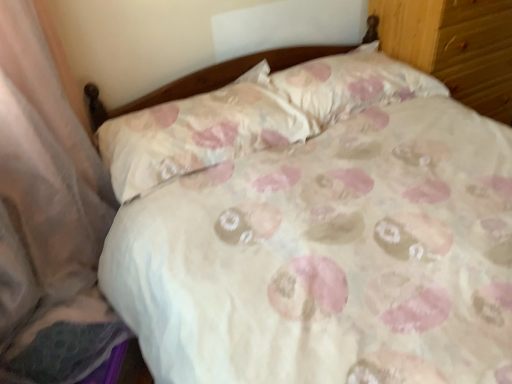
Locate an element on the screen. white fabric pillow at center, which is counted as the 1th pillow, starting from the left is located at coordinates (198, 132).

The height and width of the screenshot is (384, 512). I want to click on dresser that appears above the white fabric pillow at center, the 2th pillow in the right-to-left sequence (from the image's perspective), so click(x=455, y=46).

From a real-world perspective, is wooden dresser at upper right located beneath white fabric pillow at center, the 2th pillow in the right-to-left sequence?

Yes, from a real-world perspective, wooden dresser at upper right is under white fabric pillow at center, the 2th pillow in the right-to-left sequence.

Considering the relative positions of wooden dresser at upper right and white fabric pillow at center, which is counted as the 1th pillow, starting from the left, in the image provided, is wooden dresser at upper right to the left of white fabric pillow at center, which is counted as the 1th pillow, starting from the left, from the viewer's perspective?

In fact, wooden dresser at upper right is to the right of white fabric pillow at center, which is counted as the 1th pillow, starting from the left.

Which of these two, floral fabric pillow at upper center, the 2th pillow in the left-to-right sequence, or white fabric pillow at center, which is counted as the 1th pillow, starting from the left, stands shorter?

white fabric pillow at center, which is counted as the 1th pillow, starting from the left, is shorter.

From the picture: Is floral fabric pillow at upper center, placed as the first pillow when sorted from right to left, completely or partially outside of white fabric pillow at center, the 2th pillow in the right-to-left sequence?

Yes.

Which point is more forward, (330, 103) or (205, 116)?

The point (205, 116) is in front.

From the image's perspective, does floral fabric pillow at upper center, the 2th pillow in the left-to-right sequence, appear higher than white fabric pillow at center, which is counted as the 1th pillow, starting from the left?

Yes, from the image's perspective, floral fabric pillow at upper center, the 2th pillow in the left-to-right sequence, is above white fabric pillow at center, which is counted as the 1th pillow, starting from the left.

Is white fabric pillow at center, which is counted as the 1th pillow, starting from the left, positioned far away from floral fabric pillow at upper center, the 2th pillow in the left-to-right sequence?

No, white fabric pillow at center, which is counted as the 1th pillow, starting from the left, is in close proximity to floral fabric pillow at upper center, the 2th pillow in the left-to-right sequence.

This screenshot has width=512, height=384. I want to click on pillow in front of the floral fabric pillow at upper center, placed as the first pillow when sorted from right to left, so click(198, 132).

Does white fabric pillow at center, which is counted as the 1th pillow, starting from the left, turn towards floral fabric pillow at upper center, the 2th pillow in the left-to-right sequence?

No, white fabric pillow at center, which is counted as the 1th pillow, starting from the left, does not turn towards floral fabric pillow at upper center, the 2th pillow in the left-to-right sequence.

From their relative heights in the image, would you say white fabric pillow at center, the 2th pillow in the right-to-left sequence, is taller or shorter than floral fabric pillow at upper center, placed as the first pillow when sorted from right to left?

Clearly, white fabric pillow at center, the 2th pillow in the right-to-left sequence, is shorter compared to floral fabric pillow at upper center, placed as the first pillow when sorted from right to left.

In the image, is floral fabric pillow at upper center, the 2th pillow in the left-to-right sequence, positioned in front of or behind wooden dresser at upper right?

Visually, floral fabric pillow at upper center, the 2th pillow in the left-to-right sequence, is located in front of wooden dresser at upper right.

Looking at this image, considering the relative sizes of floral fabric pillow at upper center, the 2th pillow in the left-to-right sequence, and wooden dresser at upper right in the image provided, is floral fabric pillow at upper center, the 2th pillow in the left-to-right sequence, taller than wooden dresser at upper right?

In fact, floral fabric pillow at upper center, the 2th pillow in the left-to-right sequence, may be shorter than wooden dresser at upper right.

How different are the orientations of floral fabric pillow at upper center, the 2th pillow in the left-to-right sequence, and wooden dresser at upper right in degrees?

The angle between the facing direction of floral fabric pillow at upper center, the 2th pillow in the left-to-right sequence, and the facing direction of wooden dresser at upper right is 1.76 degrees.

From the wooden dresser at upper right, count the 1st pillow to the left and point to it. Please provide its 2D coordinates.

[(351, 84)]

Considering the relative sizes of wooden dresser at upper right and floral fabric pillow at upper center, placed as the first pillow when sorted from right to left, in the image provided, is wooden dresser at upper right taller than floral fabric pillow at upper center, placed as the first pillow when sorted from right to left,?

Indeed, wooden dresser at upper right has a greater height compared to floral fabric pillow at upper center, placed as the first pillow when sorted from right to left.

Is wooden dresser at upper right positioned far away from floral fabric pillow at upper center, placed as the first pillow when sorted from right to left?

No.

Which is correct: wooden dresser at upper right is inside floral fabric pillow at upper center, the 2th pillow in the left-to-right sequence, or outside of it?

wooden dresser at upper right is outside floral fabric pillow at upper center, the 2th pillow in the left-to-right sequence.

From the picture: Could you tell me if wooden dresser at upper right is turned towards floral fabric pillow at upper center, placed as the first pillow when sorted from right to left?

No, wooden dresser at upper right is not turned towards floral fabric pillow at upper center, placed as the first pillow when sorted from right to left.

Is white fabric pillow at center, the 2th pillow in the right-to-left sequence, thinner than wooden dresser at upper right?

Yes, white fabric pillow at center, the 2th pillow in the right-to-left sequence, is thinner than wooden dresser at upper right.

Between white fabric pillow at center, which is counted as the 1th pillow, starting from the left, and wooden dresser at upper right, which one has larger size?

Bigger between the two is wooden dresser at upper right.

Who is more distant, white fabric pillow at center, which is counted as the 1th pillow, starting from the left, or wooden dresser at upper right?

wooden dresser at upper right is more distant.

Where is `the 2nd pillow in front of the wooden dresser at upper right, counting from the anchor's position`? the 2nd pillow in front of the wooden dresser at upper right, counting from the anchor's position is located at coordinates (198, 132).

Find the location of a particular element. pillow directly beneath the white fabric pillow at center, the 2th pillow in the right-to-left sequence (from a real-world perspective) is located at coordinates (351, 84).

Based on their spatial positions, is wooden dresser at upper right or floral fabric pillow at upper center, the 2th pillow in the left-to-right sequence, closer to white fabric pillow at center, which is counted as the 1th pillow, starting from the left?

The object closer to white fabric pillow at center, which is counted as the 1th pillow, starting from the left, is floral fabric pillow at upper center, the 2th pillow in the left-to-right sequence.

When comparing their distances from floral fabric pillow at upper center, the 2th pillow in the left-to-right sequence, does white fabric pillow at center, the 2th pillow in the right-to-left sequence, or wooden dresser at upper right seem further?

wooden dresser at upper right is further to floral fabric pillow at upper center, the 2th pillow in the left-to-right sequence.

Looking at the image, which one is located further to floral fabric pillow at upper center, placed as the first pillow when sorted from right to left, wooden dresser at upper right or white fabric pillow at center, the 2th pillow in the right-to-left sequence?

The object further to floral fabric pillow at upper center, placed as the first pillow when sorted from right to left, is wooden dresser at upper right.

Which object lies nearer to the anchor point wooden dresser at upper right, white fabric pillow at center, which is counted as the 1th pillow, starting from the left, or floral fabric pillow at upper center, the 2th pillow in the left-to-right sequence?

Among the two, floral fabric pillow at upper center, the 2th pillow in the left-to-right sequence, is located nearer to wooden dresser at upper right.

Estimate the real-world distances between objects in this image. Which object is closer to white fabric pillow at center, which is counted as the 1th pillow, starting from the left, floral fabric pillow at upper center, the 2th pillow in the left-to-right sequence, or wooden dresser at upper right?

floral fabric pillow at upper center, the 2th pillow in the left-to-right sequence, is closer to white fabric pillow at center, which is counted as the 1th pillow, starting from the left.

Looking at the image, which one is located further to wooden dresser at upper right, floral fabric pillow at upper center, placed as the first pillow when sorted from right to left, or white fabric pillow at center, which is counted as the 1th pillow, starting from the left?

Among the two, white fabric pillow at center, which is counted as the 1th pillow, starting from the left, is located further to wooden dresser at upper right.

This screenshot has height=384, width=512. Identify the location of pillow between white fabric pillow at center, which is counted as the 1th pillow, starting from the left, and wooden dresser at upper right. (351, 84).